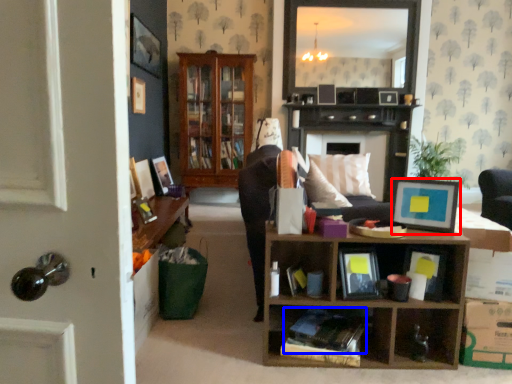
Question: Which of the following is the closest to the observer, picture frame (highlighted by a red box) or book (highlighted by a blue box)?

Choices:
 (A) picture frame
 (B) book

Answer: (B)